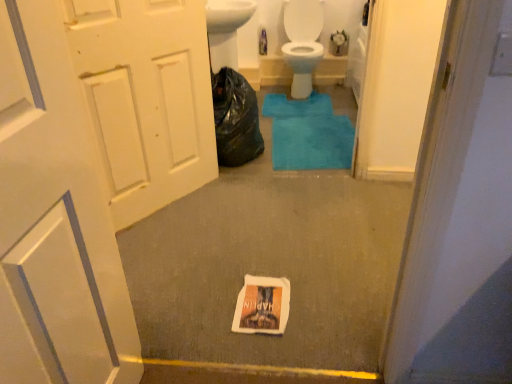
Find the location of a particular element. The height and width of the screenshot is (384, 512). empty space that is to the right of white matte door at left, which appears as the second door when viewed from the front is located at coordinates (220, 209).